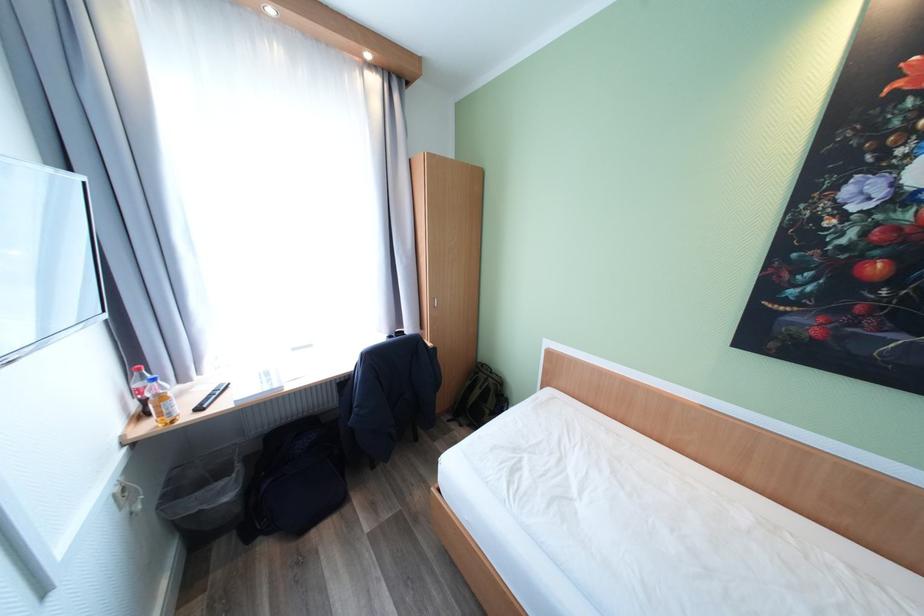
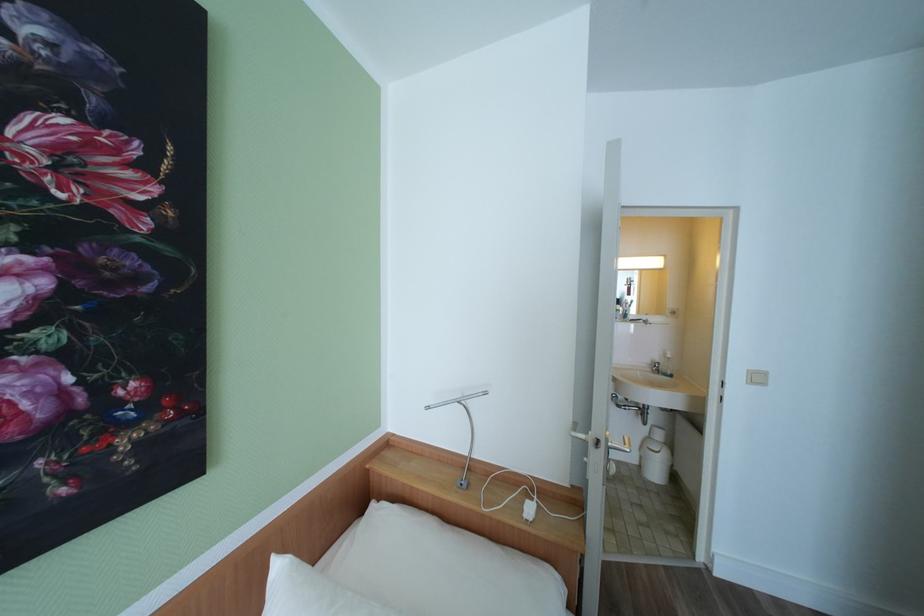
Question: Based on the continuous images, in which direction is the camera rotating? Reply with the corresponding letter.

Choices:
 (A) Left
 (B) Right
 (C) Up
 (D) Down

Answer: (B)